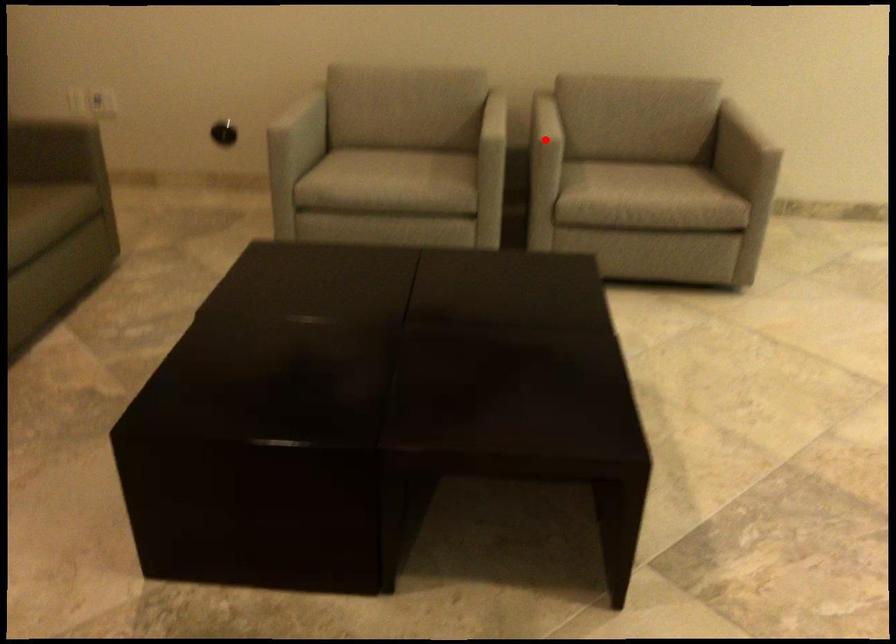
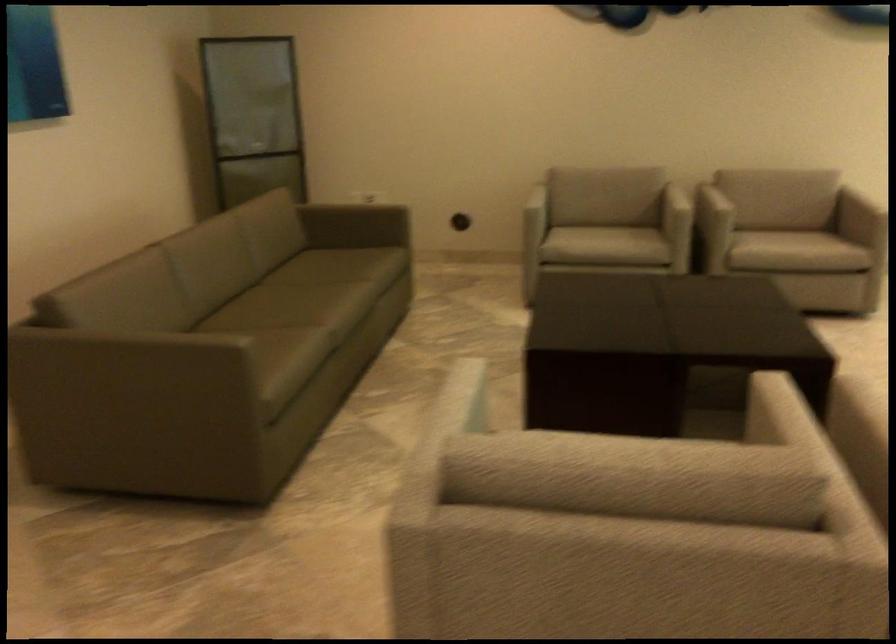
Question: I am providing you with two images of the same scene from different viewpoints. Image1 has a red point marked. In image2, the corresponding 3D location appears at what relative position? Reply with the corresponding letter.

Choices:
 (A) Closer
 (B) Farther

Answer: (B)